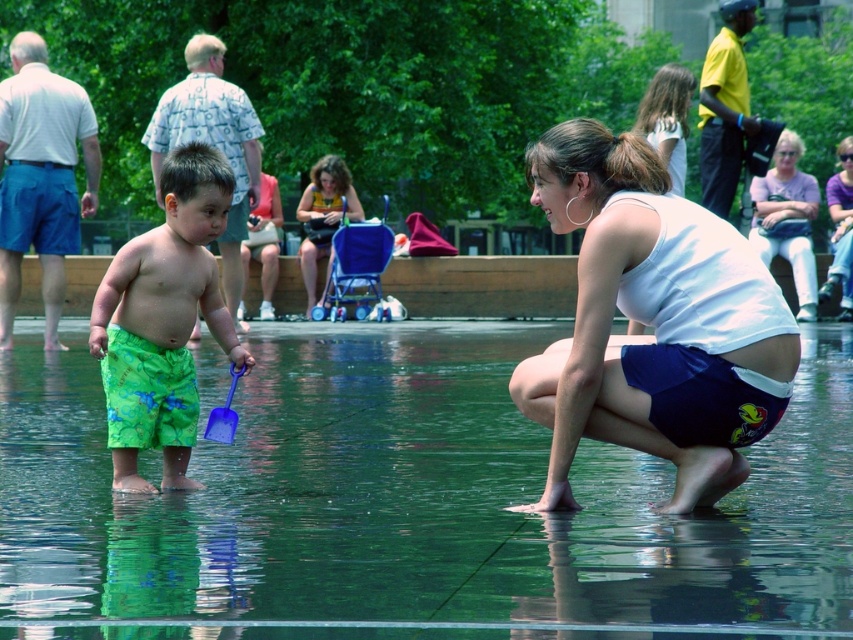
Can you confirm if blonde hair at upper center is positioned below blue plastic shovel at lower center?

No.

Between blonde hair at upper center and blue plastic shovel at lower center, which one is positioned higher?

Positioned higher is blonde hair at upper center.

Locate an element on the screen. blonde hair at upper center is located at coordinates (666, 118).

Is green fabric shorts at left to the right of blonde hair at upper center from the viewer's perspective?

Incorrect, green fabric shorts at left is not on the right side of blonde hair at upper center.

Identify the location of green fabric shorts at left. (212, 144).

The image size is (853, 640). Identify the location of green fabric shorts at left. (212, 144).

Does green swim trunks at left have a larger size compared to green fabric shorts at left?

Incorrect, green swim trunks at left is not larger than green fabric shorts at left.

This screenshot has height=640, width=853. What do you see at coordinates (41, 179) in the screenshot?
I see `green swim trunks at left` at bounding box center [41, 179].

The height and width of the screenshot is (640, 853). In order to click on green swim trunks at left in this screenshot , I will do `click(41, 179)`.